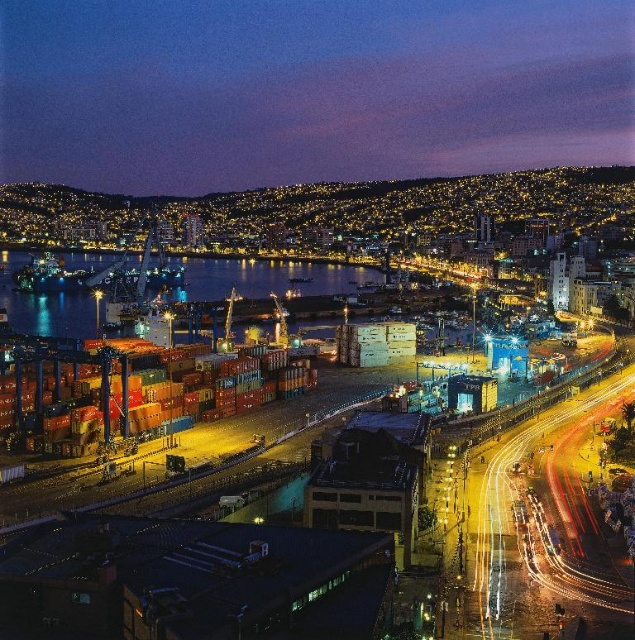
Measure the distance between metallic containers at center and dark blue water at center.

metallic containers at center is 116.06 meters away from dark blue water at center.

Is point (203, 355) closer to camera compared to point (211, 269)?

Yes.

Measure the distance between metallic containers at center and camera.

81.29 meters

Identify the location of metallic containers at center. The image size is (635, 640). (130, 388).